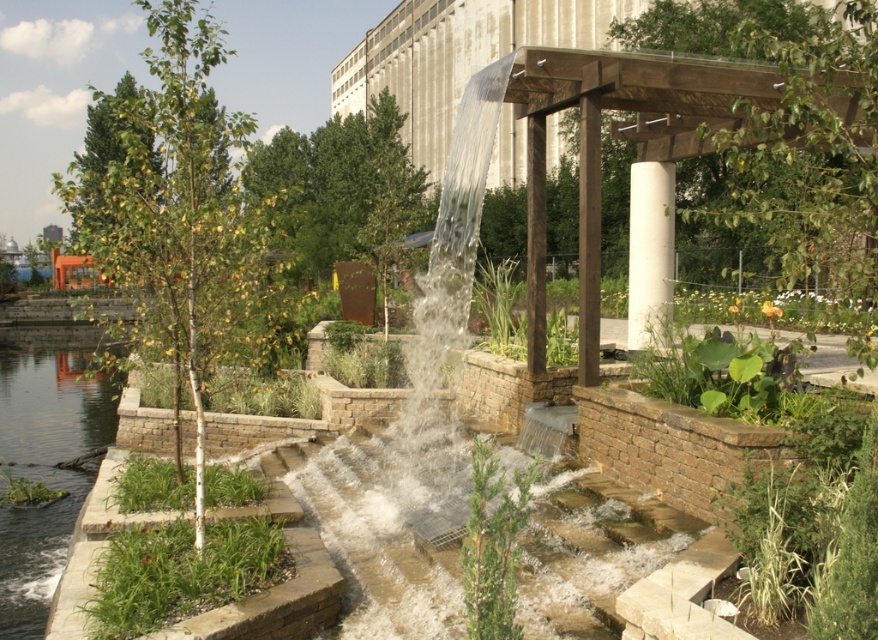
In the scene shown: Who is shorter, clear water at lower left or white smooth column at center?

Standing shorter between the two is white smooth column at center.

Is clear water at lower left in front of white smooth column at center?

Yes, it is.

You are a GUI agent. You are given a task and a screenshot of the screen. Output one action in this format:
    pyautogui.click(x=<x>, y=<y>)
    Task: Click on the clear water at lower left
    This screenshot has width=878, height=640.
    Given the screenshot: What is the action you would take?
    pyautogui.click(x=45, y=456)

Where is `clear water at lower left`? clear water at lower left is located at coordinates (45, 456).